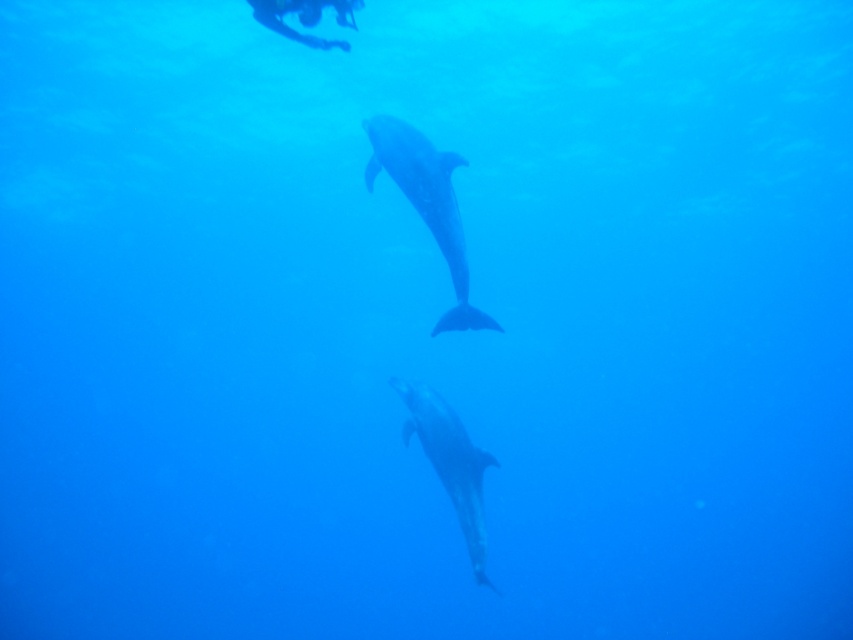
Which is above, glossy dolphin at center or blue rubber mask at upper center?

blue rubber mask at upper center is higher up.

Is glossy dolphin at center above blue rubber mask at upper center?

No, glossy dolphin at center is not above blue rubber mask at upper center.

Describe the element at coordinates (450, 464) in the screenshot. I see `glossy dolphin at center` at that location.

At what (x,y) coordinates should I click in order to perform the action: click on glossy dolphin at center. Please return your answer as a coordinate pair (x, y). The height and width of the screenshot is (640, 853). Looking at the image, I should click on click(450, 464).

How distant is smooth gray dolphin at center from glossy dolphin at center?

39.18 inches

Who is more distant from viewer, (372, 122) or (448, 445)?

The point (448, 445) is behind.

This screenshot has width=853, height=640. I want to click on smooth gray dolphin at center, so click(x=427, y=204).

Does smooth gray dolphin at center come behind blue rubber mask at upper center?

Yes.

Who is more forward, [463,305] or [305,13]?

Point [305,13] is more forward.

This screenshot has height=640, width=853. Identify the location of smooth gray dolphin at center. (427, 204).